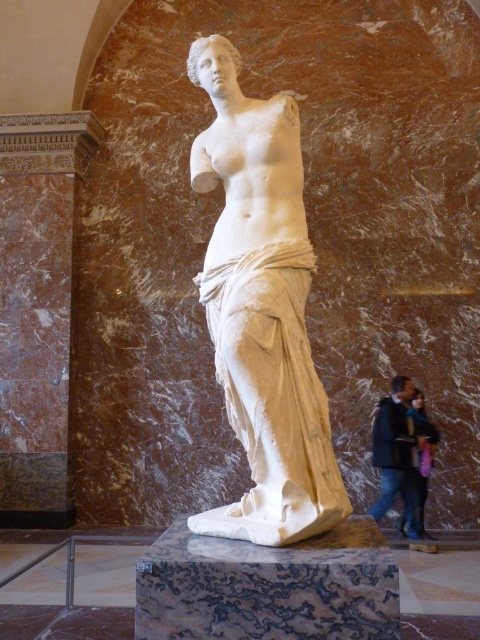
Between marble column at left and marble/granite pedestal at center, which one is positioned higher?

Positioned higher is marble column at left.

Who is more distant from viewer, (46,433) or (298,570)?

Point (46,433)

Identify the location of marble column at left. (37, 308).

Is marble column at left bigger than dark blue jacket at lower right?

No, marble column at left is not bigger than dark blue jacket at lower right.

Which is in front, point (93, 134) or point (385, 444)?

Point (385, 444) is more forward.

At what (x,y) coordinates should I click in order to perform the action: click on marble column at left. Please return your answer as a coordinate pair (x, y). Image resolution: width=480 pixels, height=640 pixels. Looking at the image, I should click on (37, 308).

Does white marble statue at center have a greater width compared to marble column at left?

In fact, white marble statue at center might be narrower than marble column at left.

Which is below, white marble statue at center or marble column at left?

white marble statue at center is lower down.

Which is behind, point (327, 410) or point (25, 451)?

Positioned behind is point (25, 451).

Identify the location of white marble statue at center. (262, 308).